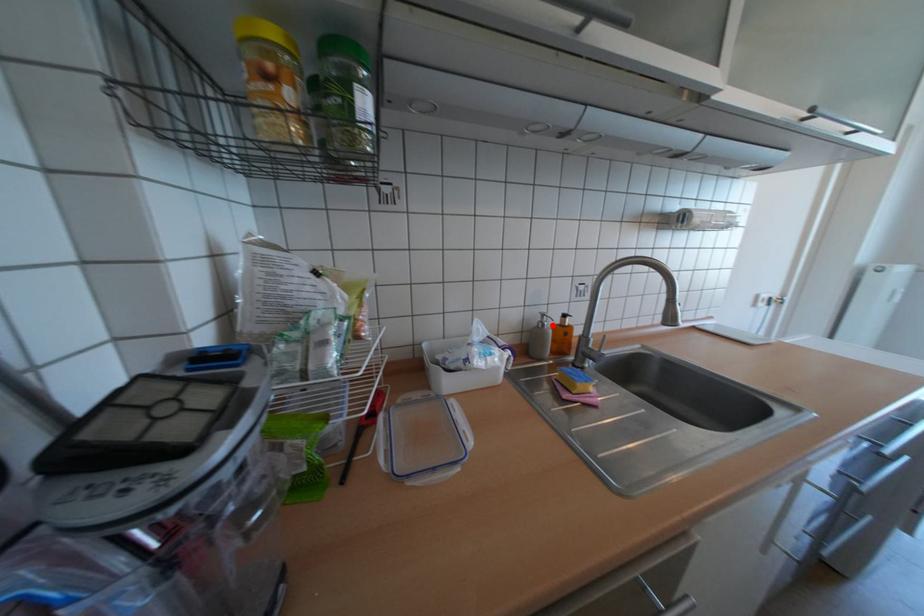
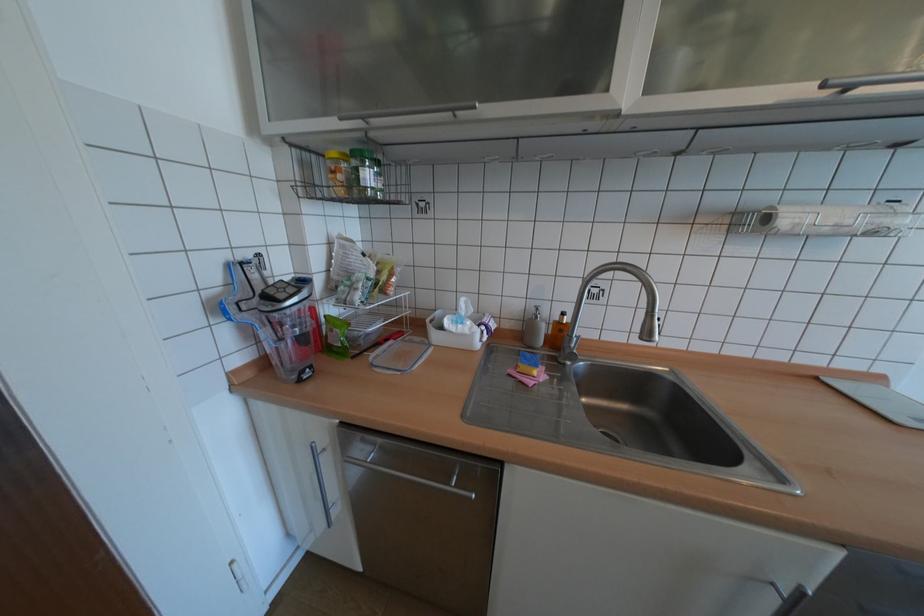
Locate, in the second image, the point that corresponds to the highlighted location in the first image.

(545, 317)